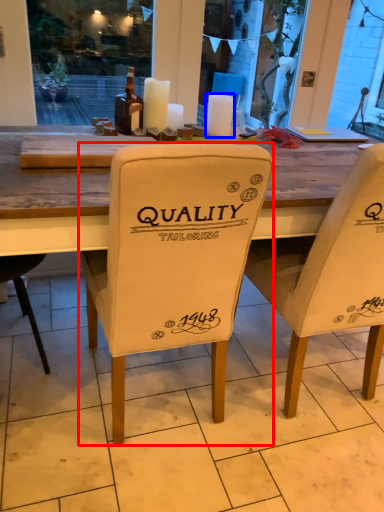
Question: Among these objects, which one is nearest to the camera, chair (highlighted by a red box) or candle (highlighted by a blue box)?

Choices:
 (A) chair
 (B) candle

Answer: (A)